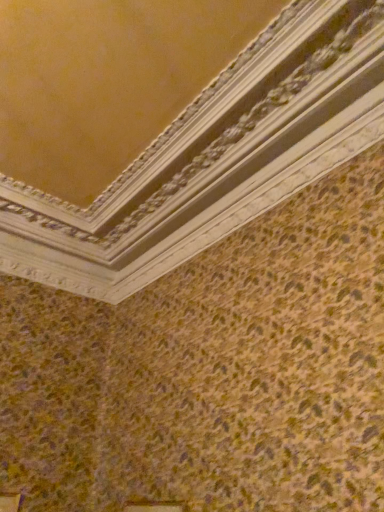
What do you see at coordinates (214, 156) in the screenshot?
I see `white textured molding at upper center` at bounding box center [214, 156].

The width and height of the screenshot is (384, 512). Find the location of `white textured molding at upper center`. white textured molding at upper center is located at coordinates (214, 156).

Find the location of a particular element. The width and height of the screenshot is (384, 512). white textured molding at upper center is located at coordinates (214, 156).